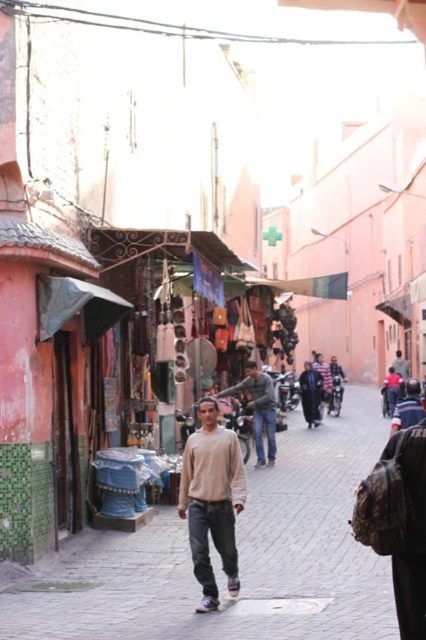
You are a customer in this market and want to buy both the beige cotton sweater at center and the dark blue fabric at center. Which item is positioned higher up on the display?

The beige cotton sweater at center is located above the dark blue fabric at center, so it is positioned higher up on the display.